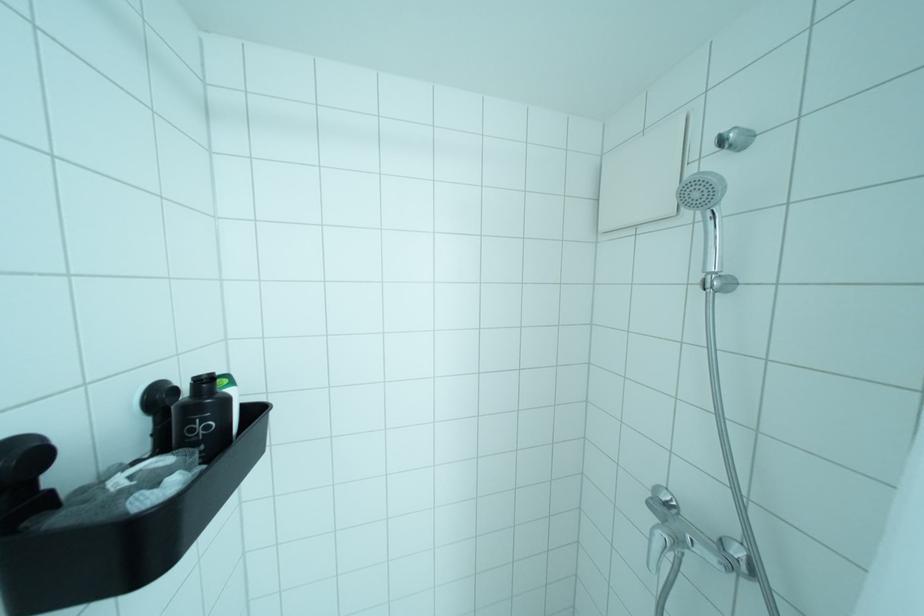
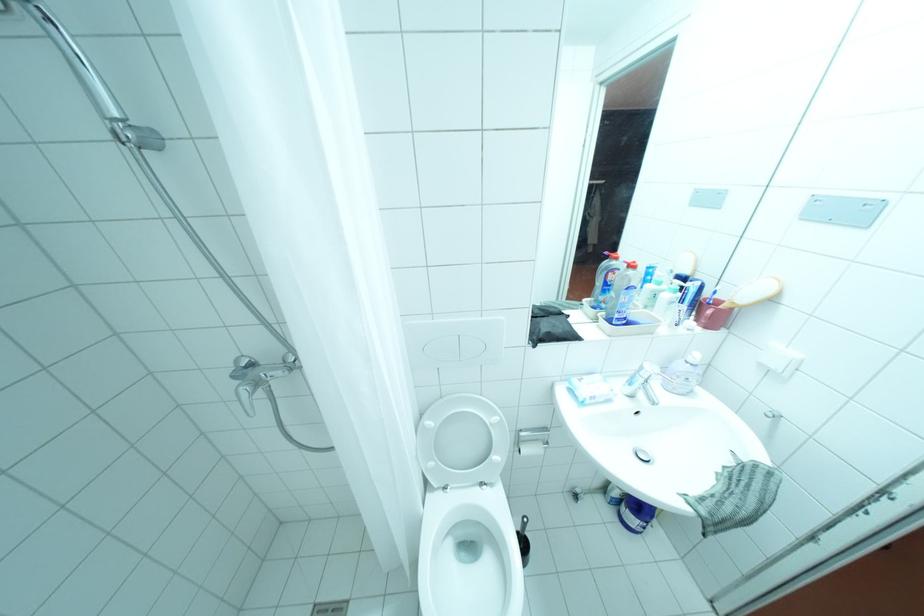
In the second image, find the point that corresponds to (x=666, y=488) in the first image.

(246, 360)